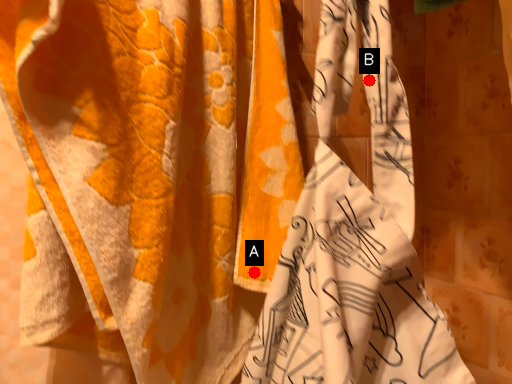
Question: Two points are circled on the image, labeled by A and B beside each circle. Which point appears closest to the camera in this image?

Choices:
 (A) A is closer
 (B) B is closer

Answer: (B)